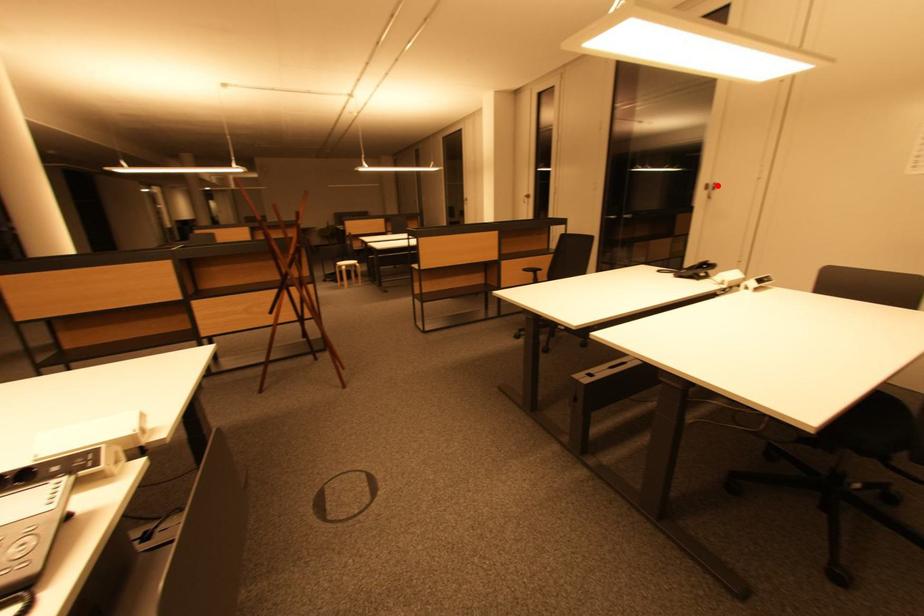
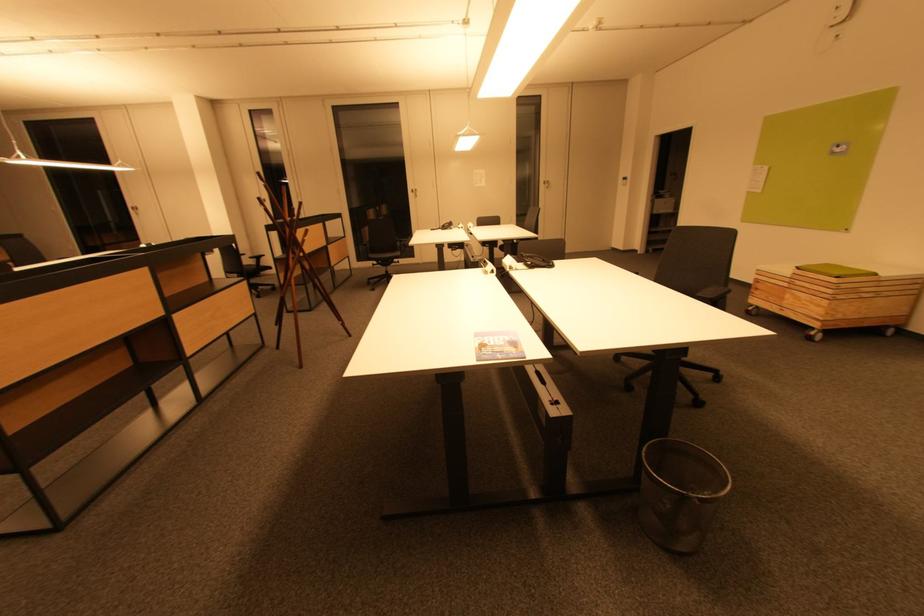
Question: I am providing you with two images of the same scene from different viewpoints. Given a red point in image1, look at the same physical point in image2. Is it:

Choices:
 (A) Closer to the viewpoint
 (B) Farther from the viewpoint

Answer: (A)